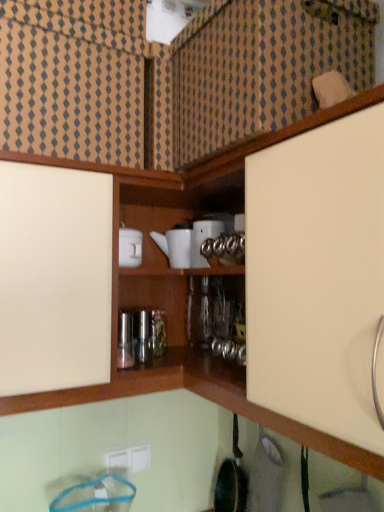
Question: In terms of size, does white plastic electric outlet at lower center appear bigger or smaller than white ceramic teapot at center, the 2th appliance from the right?

Choices:
 (A) small
 (B) big

Answer: (A)

Question: Relative to white ceramic teapot at center, the 2th appliance from the right, is white plastic electric outlet at lower center in front or behind?

Choices:
 (A) behind
 (B) front

Answer: (A)

Question: Which object is the closest to the white plastic electric outlet at lower center?

Choices:
 (A) white ceramic teapot at center, the 2th appliance from the right
 (B) white glossy teapot at upper center, arranged as the second appliance when viewed from the left

Answer: (A)

Question: Estimate the real-world distances between objects in this image. Which object is closer to the white glossy teapot at upper center, arranged as the second appliance when viewed from the left?

Choices:
 (A) white plastic electric outlet at lower center
 (B) white ceramic teapot at center, placed as the 1th appliance when sorted from left to right

Answer: (B)